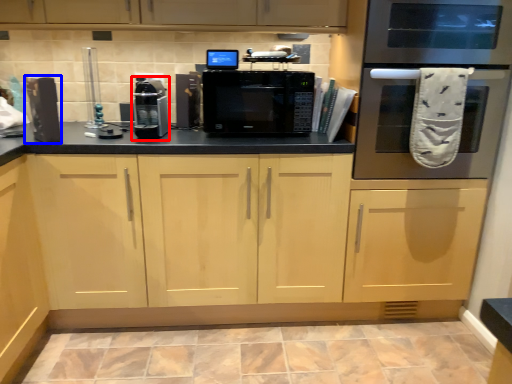
Question: Which object appears farthest to the camera in this image, appliance (highlighted by a red box) or appliance (highlighted by a blue box)?

Choices:
 (A) appliance
 (B) appliance

Answer: (A)